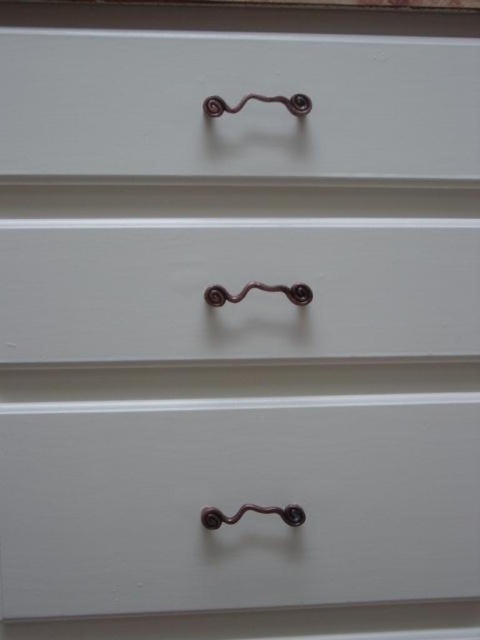
You are organizing a small item and need to place it in one of the drawers. If you want to ensure the item is easily accessible, which drawer should you choose between the white matte drawer at lower center and the matte white drawer at center?

The white matte drawer at lower center is more accessible because it is in front of the matte white drawer at center, making it easier to reach without moving other drawers.

You are organizing a drawer and notice the matte brown handle at upper center and the matte white drawer at center. Which one is positioned higher?

The matte brown handle at upper center is positioned higher than the matte white drawer at center.